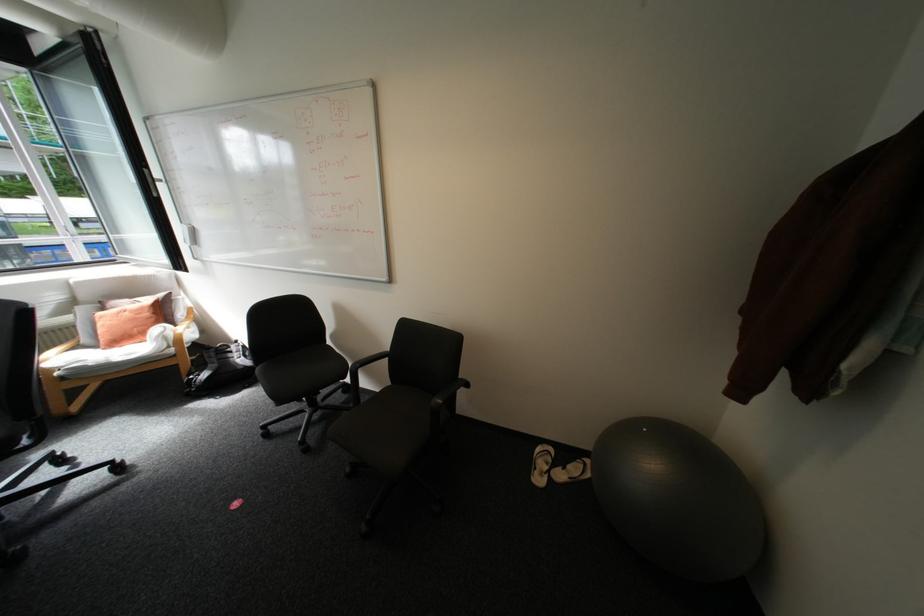
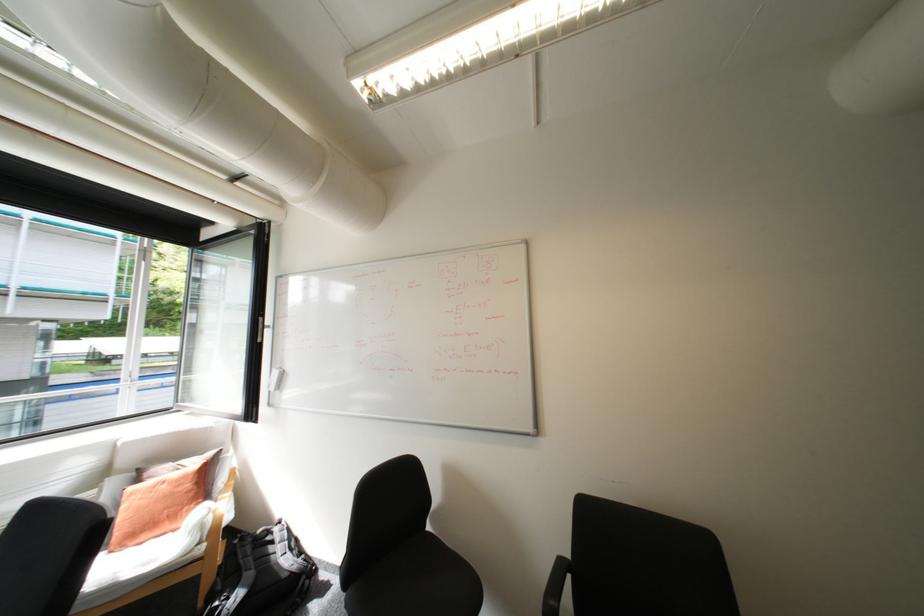
The point at (160, 180) is marked in the first image. Where is the corresponding point in the second image?

(271, 326)